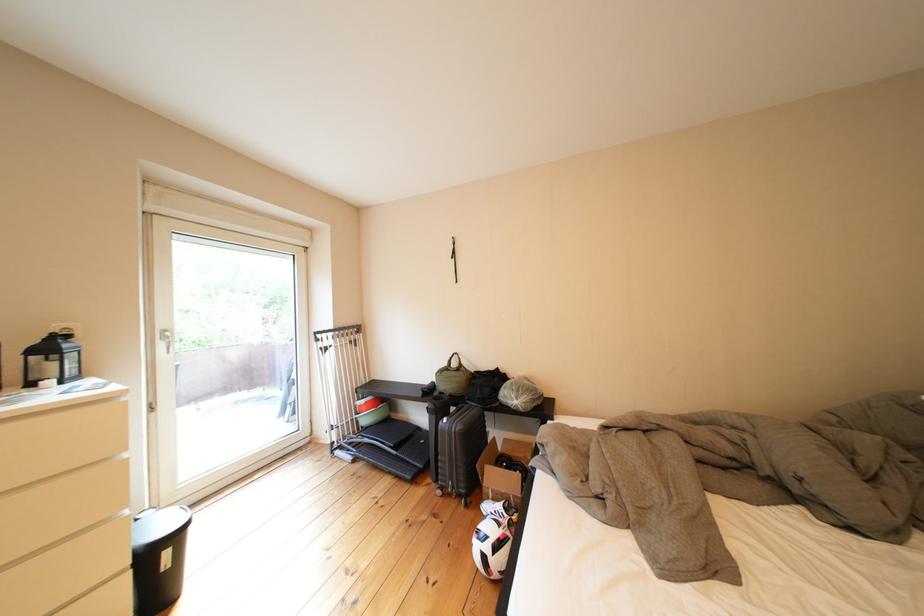
This screenshot has height=616, width=924. Identify the location of black lantern handle. (70, 365).